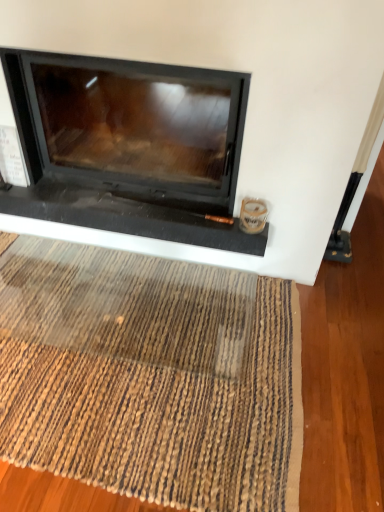
Find the location of a particular element. free space above brown woven mat at lower center (from a real-world perspective) is located at coordinates (122, 346).